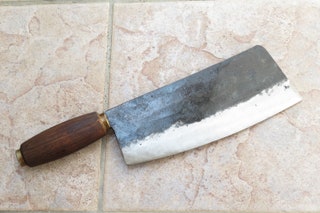
This screenshot has width=320, height=213. Find the location of `tile`. tile is located at coordinates (58, 74), (159, 68).